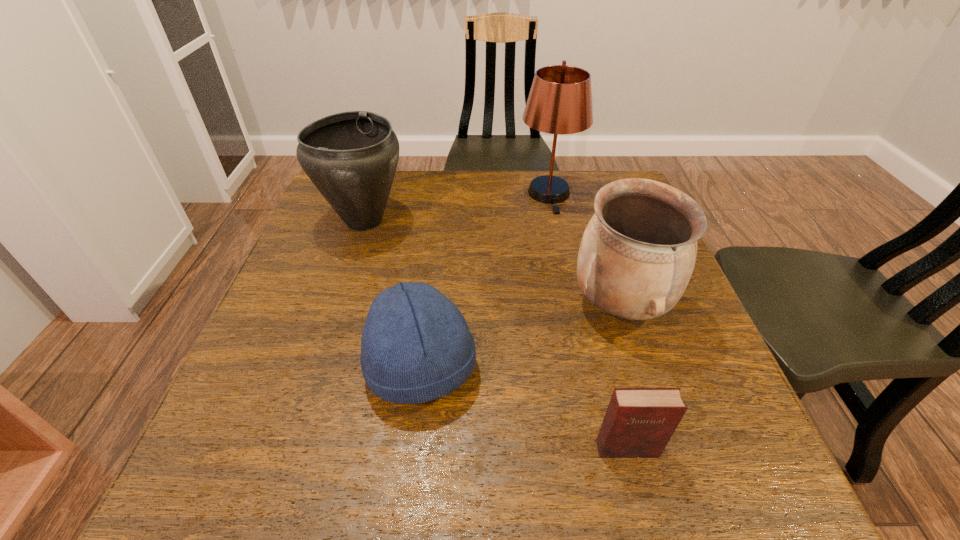
Identify the location of urn located in the far edge section of the desktop. (351, 157).

The image size is (960, 540). What are the coordinates of `object that is positioned at the near edge` in the screenshot? It's located at (639, 422).

Find the location of a particular element. The width and height of the screenshot is (960, 540). object located in the left edge section of the desktop is located at coordinates (351, 157).

Locate an element on the screen. The image size is (960, 540). lampshade situated at the right edge is located at coordinates point(560,100).

This screenshot has height=540, width=960. I want to click on urn at the right edge, so click(637, 254).

I want to click on object located in the far left corner section of the desktop, so click(x=351, y=157).

What are the coordinates of `object present at the far right corner` in the screenshot? It's located at (560, 100).

This screenshot has width=960, height=540. Identify the location of blank space at the far edge of the desktop. (465, 171).

Locate an element on the screen. This screenshot has height=540, width=960. vacant point at the left edge is located at coordinates (326, 271).

Locate an element on the screen. vacant space at the right edge of the desktop is located at coordinates (721, 420).